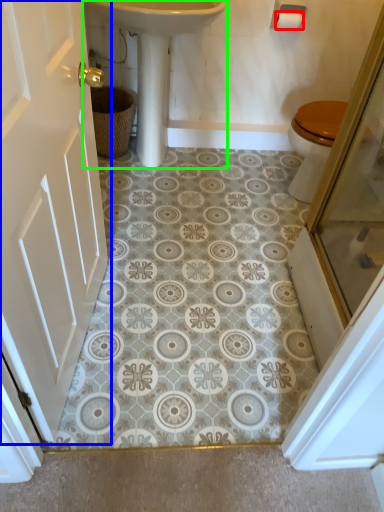
Question: Estimate the real-world distances between objects in this image. Which object is farther from toilet paper (highlighted by a red box), door (highlighted by a blue box) or sink (highlighted by a green box)?

Choices:
 (A) door
 (B) sink

Answer: (A)